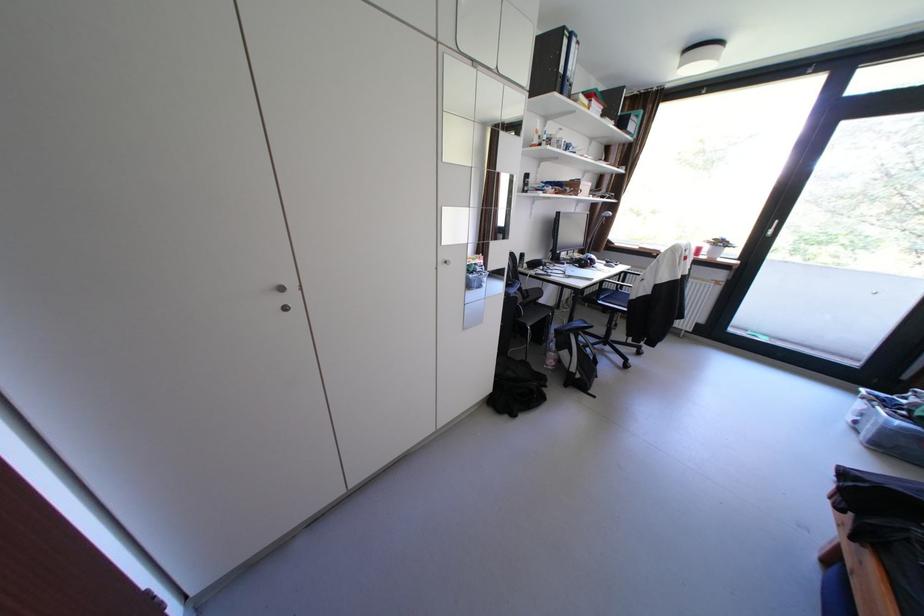
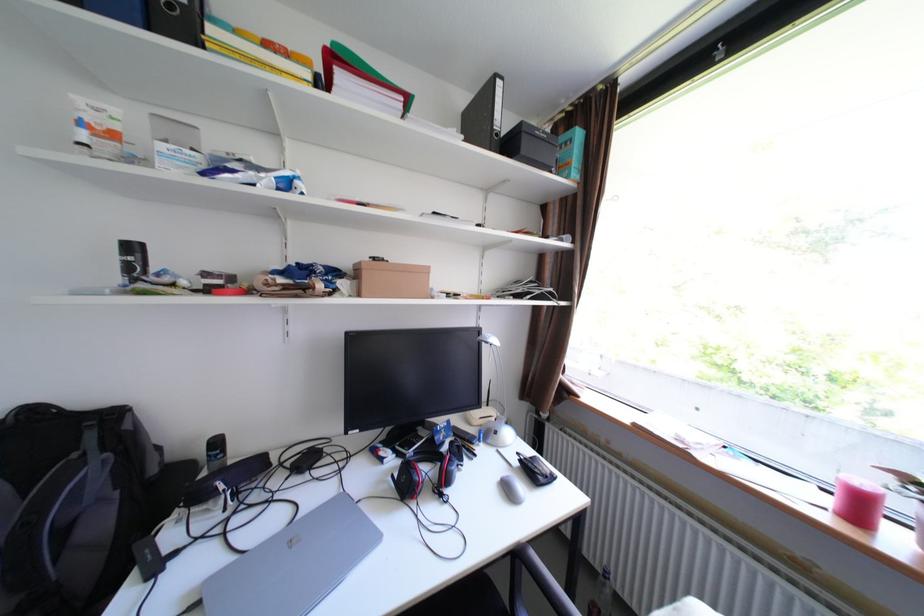
Which direction would the cameraman need to move to produce the second image?

The movement direction of the cameraman is right, forward.